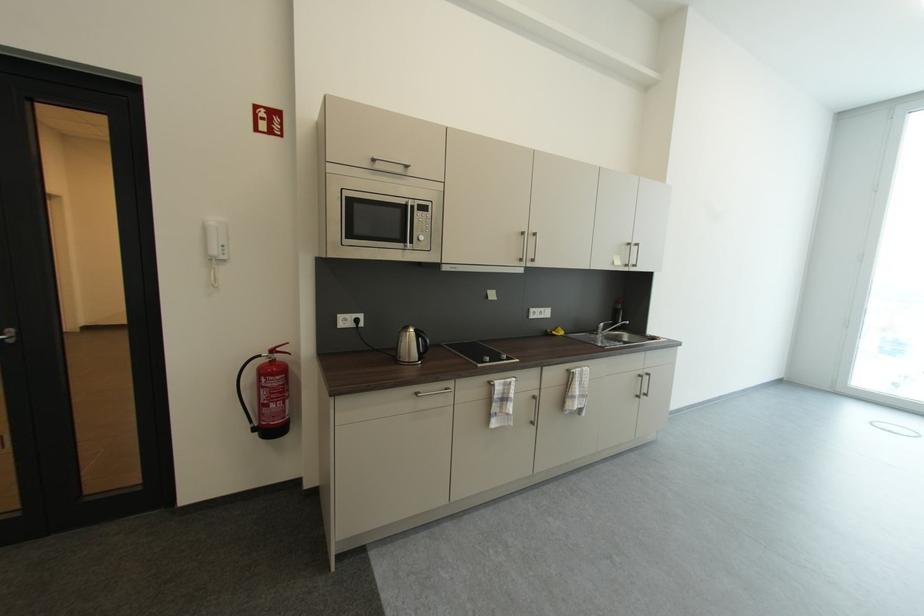
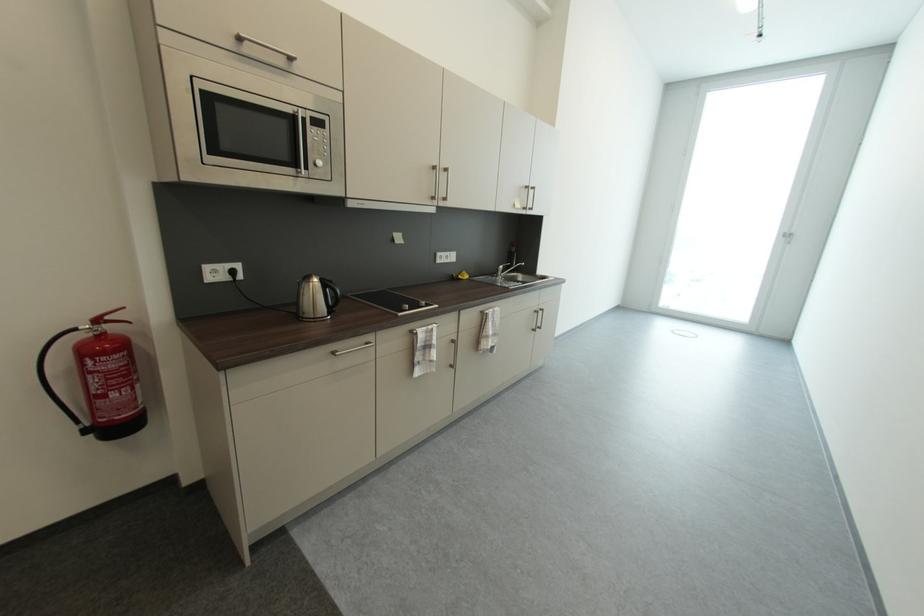
In the second image, find the point that corresponds to point (426, 241) in the first image.

(322, 166)